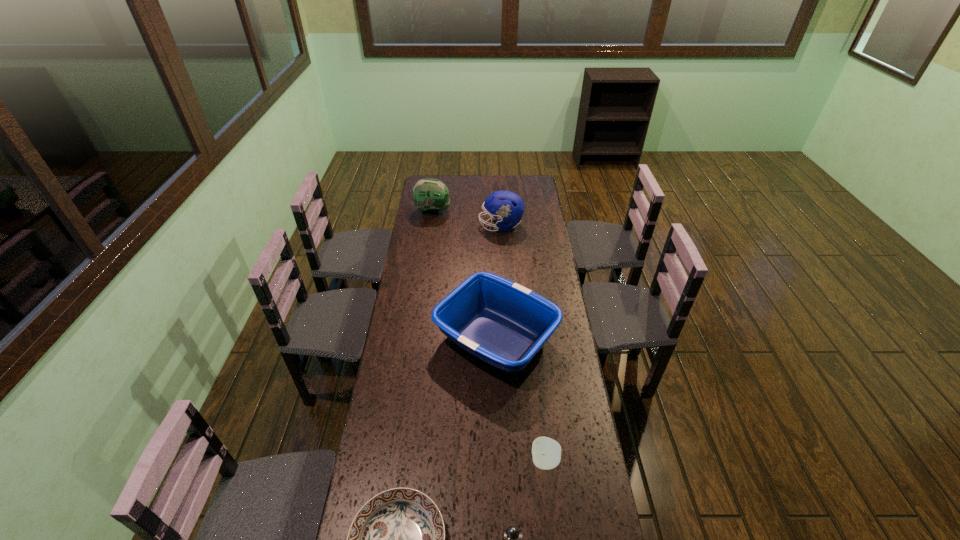
Locate an element on the screen. free spot located 0.130m on the front of the third nearest object is located at coordinates (552, 519).

This screenshot has height=540, width=960. In order to click on object present at the left edge in this screenshot , I will do `click(430, 195)`.

Find the location of a particular element. The height and width of the screenshot is (540, 960). football helmet that is at the right edge is located at coordinates (507, 207).

Find the location of a particular element. This screenshot has width=960, height=540. tray that is at the right edge is located at coordinates (502, 323).

Locate an element on the screen. apple present at the right edge is located at coordinates pyautogui.click(x=546, y=452).

This screenshot has width=960, height=540. In the image, there is a desktop. Identify the location of vacant space at the far edge. (471, 181).

At what (x,y) coordinates should I click in order to perform the action: click on free space at the left edge. Please return your answer as a coordinate pair (x, y). This screenshot has width=960, height=540. Looking at the image, I should click on [363, 479].

This screenshot has height=540, width=960. In the image, there is a desktop. Identify the location of free space at the right edge. (572, 517).

At what (x,y) coordinates should I click in order to perform the action: click on vacant area between the left football helmet and the third farthest object. Please return your answer as a coordinate pair (x, y). The height and width of the screenshot is (540, 960). Looking at the image, I should click on (465, 275).

Image resolution: width=960 pixels, height=540 pixels. Find the location of `vacant point located between the left football helmet and the third tallest object`. vacant point located between the left football helmet and the third tallest object is located at coordinates (465, 275).